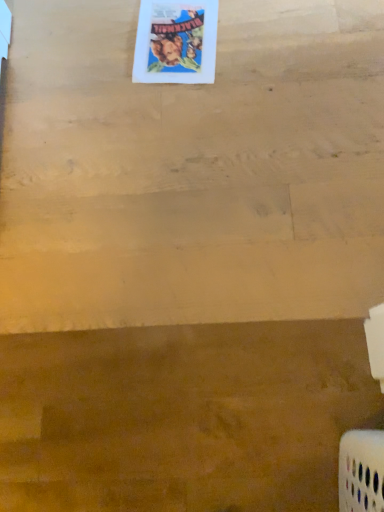
Find the location of a particular element. This screenshot has width=384, height=512. free spot below matte paper comic book at upper center (from a real-world perspective) is located at coordinates (177, 37).